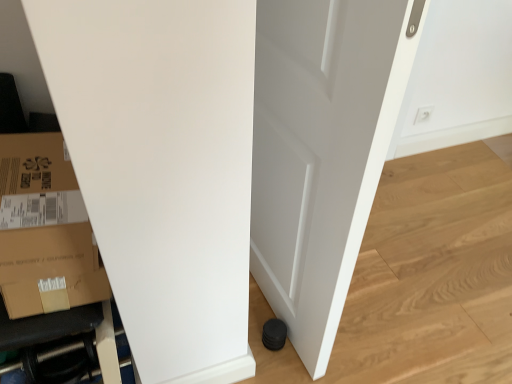
Question: Is brown cardboard box at lower left further to camera compared to white matte door at center?

Choices:
 (A) no
 (B) yes

Answer: (B)

Question: Is brown cardboard box at lower left at the right side of white matte door at center?

Choices:
 (A) no
 (B) yes

Answer: (A)

Question: Does brown cardboard box at lower left come in front of white matte door at center?

Choices:
 (A) no
 (B) yes

Answer: (A)

Question: Is brown cardboard box at lower left wider than white matte door at center?

Choices:
 (A) no
 (B) yes

Answer: (B)

Question: Would you say brown cardboard box at lower left is outside white matte door at center?

Choices:
 (A) yes
 (B) no

Answer: (A)

Question: Is brown cardboard box at lower left smaller than white matte door at center?

Choices:
 (A) no
 (B) yes

Answer: (B)

Question: Is brown cardboard box at lower left completely or partially outside of black rubber hose at lower left?

Choices:
 (A) no
 (B) yes

Answer: (B)

Question: Can you confirm if brown cardboard box at lower left is smaller than black rubber hose at lower left?

Choices:
 (A) no
 (B) yes

Answer: (A)

Question: Is brown cardboard box at lower left thinner than black rubber hose at lower left?

Choices:
 (A) yes
 (B) no

Answer: (B)

Question: Does brown cardboard box at lower left lie in front of black rubber hose at lower left?

Choices:
 (A) yes
 (B) no

Answer: (A)

Question: From the image's perspective, is brown cardboard box at lower left on black rubber hose at lower left?

Choices:
 (A) yes
 (B) no

Answer: (A)

Question: Does brown cardboard box at lower left have a greater width compared to black rubber hose at lower left?

Choices:
 (A) yes
 (B) no

Answer: (A)

Question: Can you confirm if white matte door at center is positioned to the right of white plastic electric outlet at upper right?

Choices:
 (A) yes
 (B) no

Answer: (B)